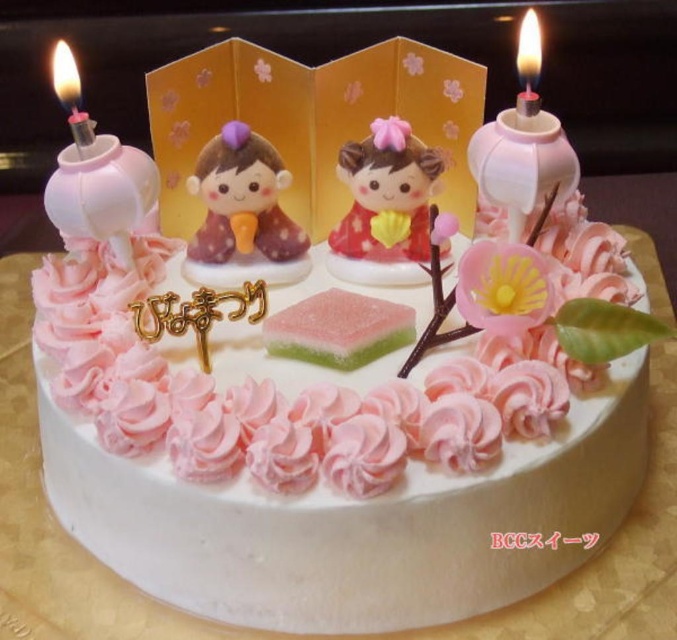
Question: Among these objects, which one is farthest from the camera?

Choices:
 (A) matte brown figurine at center
 (B) green sugar cube at center

Answer: (A)

Question: Does translucent white candle at left appear under translucent glass candle at upper right?

Choices:
 (A) yes
 (B) no

Answer: (A)

Question: Which object appears farthest from the camera in this image?

Choices:
 (A) matte brown figurine at center
 (B) translucent glass candle at upper right

Answer: (A)

Question: Does matte pink clay doll at center have a smaller size compared to translucent glass candle at upper right?

Choices:
 (A) yes
 (B) no

Answer: (B)

Question: Does matte pink clay doll at center come in front of translucent glass candle at upper right?

Choices:
 (A) yes
 (B) no

Answer: (B)

Question: Estimate the real-world distances between objects in this image. Which object is closer to the matte brown figurine at center?

Choices:
 (A) green sugar cube at center
 (B) translucent white candle at left

Answer: (A)